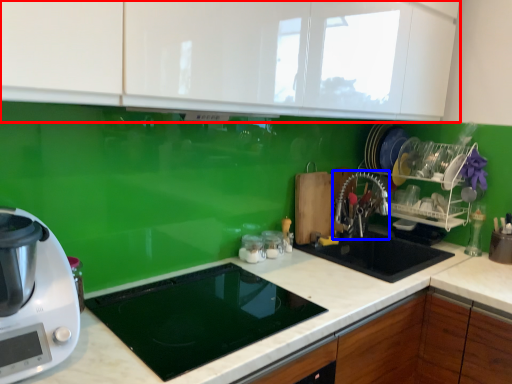
Question: Which of the following is the closest to the observer, cabinetry (highlighted by a red box) or faucet (highlighted by a blue box)?

Choices:
 (A) cabinetry
 (B) faucet

Answer: (A)